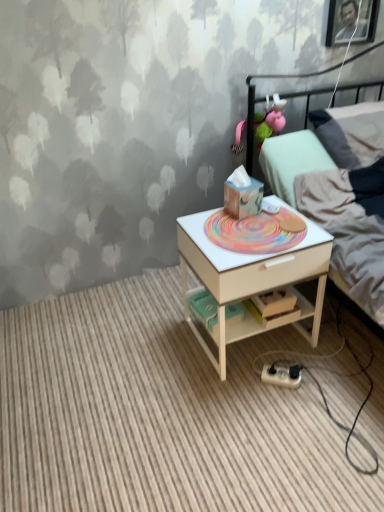
Find the location of a particular element. vacant space situated on the left part of white wood desk at center is located at coordinates (154, 343).